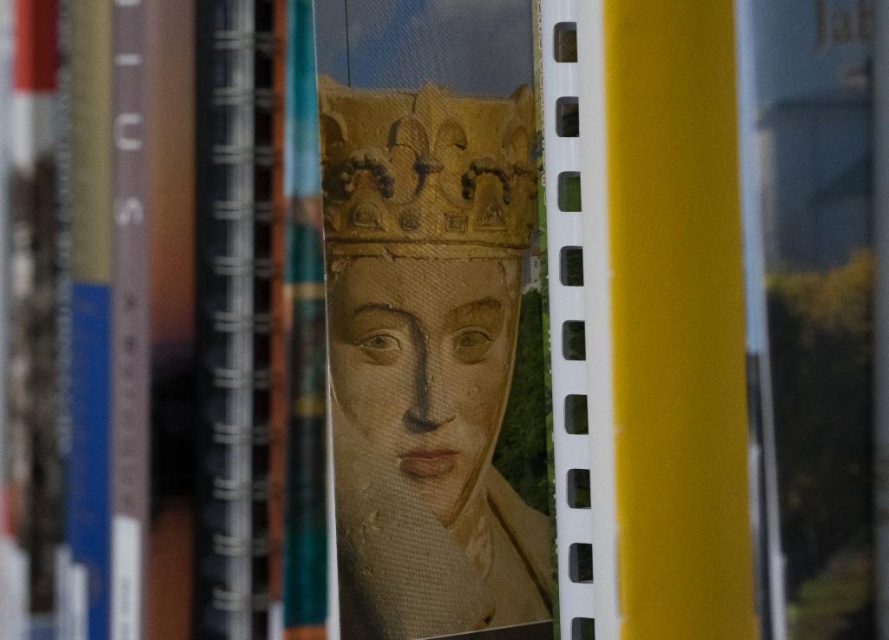
Is matte gold crown at center in front of gold textured crown at center?

No, matte gold crown at center is further to the viewer.

This screenshot has height=640, width=889. In order to click on matte gold crown at center in this screenshot , I will do `click(422, 365)`.

This screenshot has height=640, width=889. Identify the location of matte gold crown at center. (422, 365).